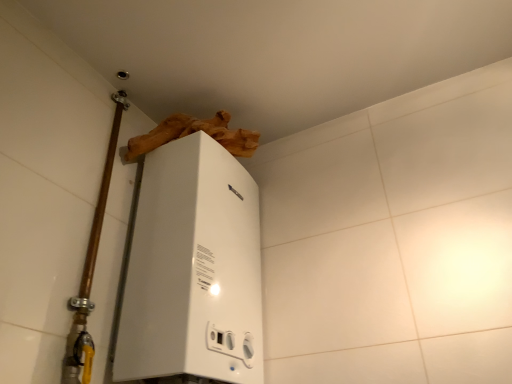
Find the location of a particular element. white glossy boiler at upper center is located at coordinates (193, 269).

The height and width of the screenshot is (384, 512). What do you see at coordinates (193, 269) in the screenshot?
I see `white glossy boiler at upper center` at bounding box center [193, 269].

You are a GUI agent. You are given a task and a screenshot of the screen. Output one action in this format:
    pyautogui.click(x=<x>, y=<y>)
    Task: Click on the white glossy boiler at upper center
    Image resolution: width=512 pixels, height=384 pixels.
    Given the screenshot: What is the action you would take?
    click(193, 269)